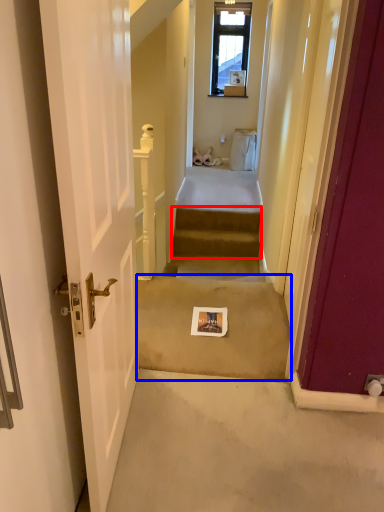
Question: Among these objects, which one is nearest to the camera, stairs (highlighted by a red box) or concrete (highlighted by a blue box)?

Choices:
 (A) stairs
 (B) concrete

Answer: (B)